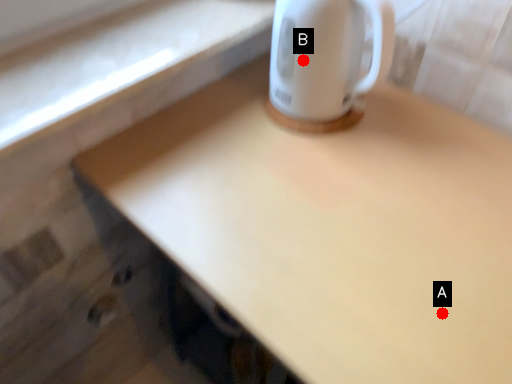
Question: Two points are circled on the image, labeled by A and B beside each circle. Which point is closer to the camera?

Choices:
 (A) A is closer
 (B) B is closer

Answer: (A)